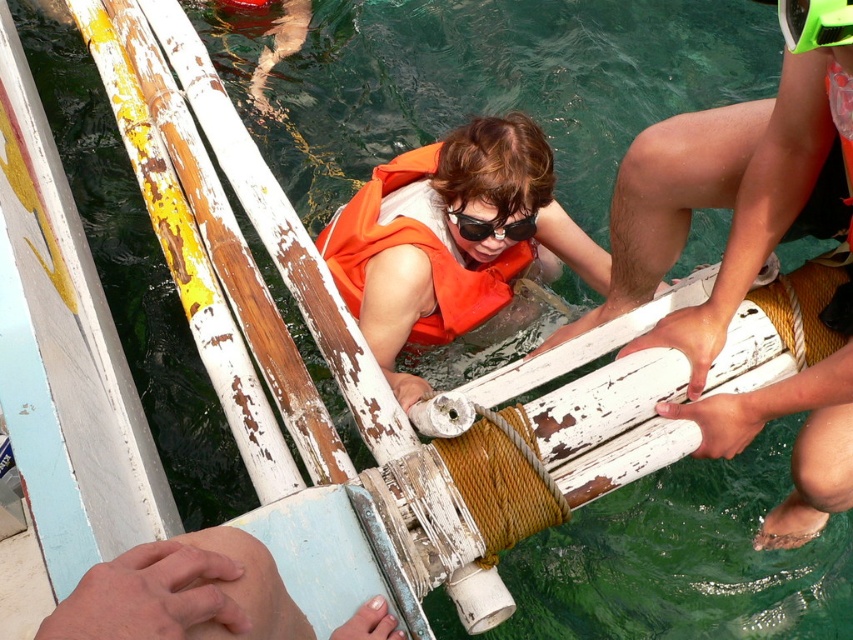
Based on the photo, you are a safety inspector checking the equipment of a swimmer. You notice the orange fabric life jacket at center and the black plastic goggles at center. Which piece of equipment is positioned higher on the swimmer?

The orange fabric life jacket at center is much taller than the black plastic goggles at center, so the life jacket is positioned higher on the swimmer.

You are a safety inspector checking the placement of safety gear on a boat. The orange fabric life jacket at center and the black plastic goggles at center are both mounted on a rack. Which item is positioned more to the left?

The orange fabric life jacket at center is positioned to the left of the black plastic goggles at center, so it is more to the left.